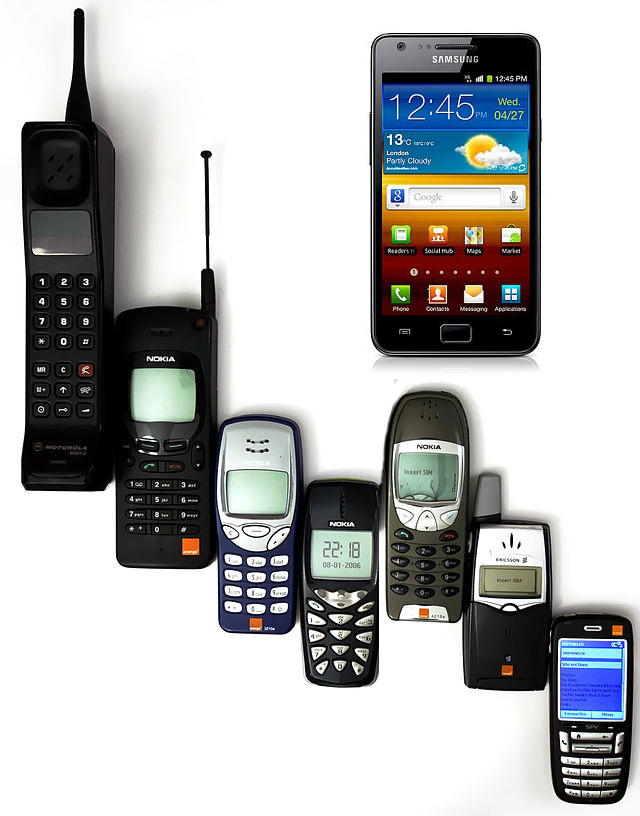
I want to click on phone screens, so point(73,227), point(159,384), point(274,508), point(346,561), point(417,481), point(496,571), point(577,692), point(454,109).